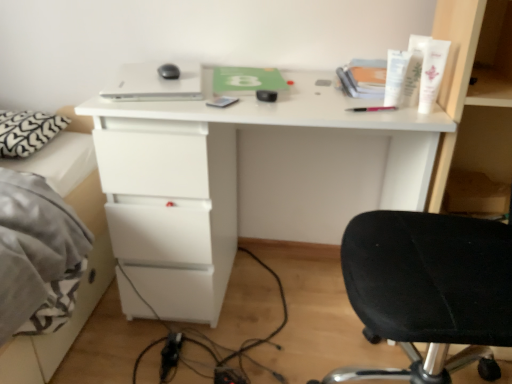
This screenshot has height=384, width=512. In order to click on vacant space to the right of matte gray notepad at center in this screenshot , I will do `click(280, 103)`.